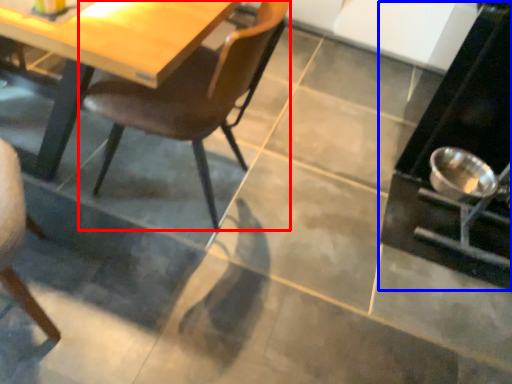
Question: Which object appears closest to the camera in this image, chair (highlighted by a red box) or appliance (highlighted by a blue box)?

Choices:
 (A) chair
 (B) appliance

Answer: (A)